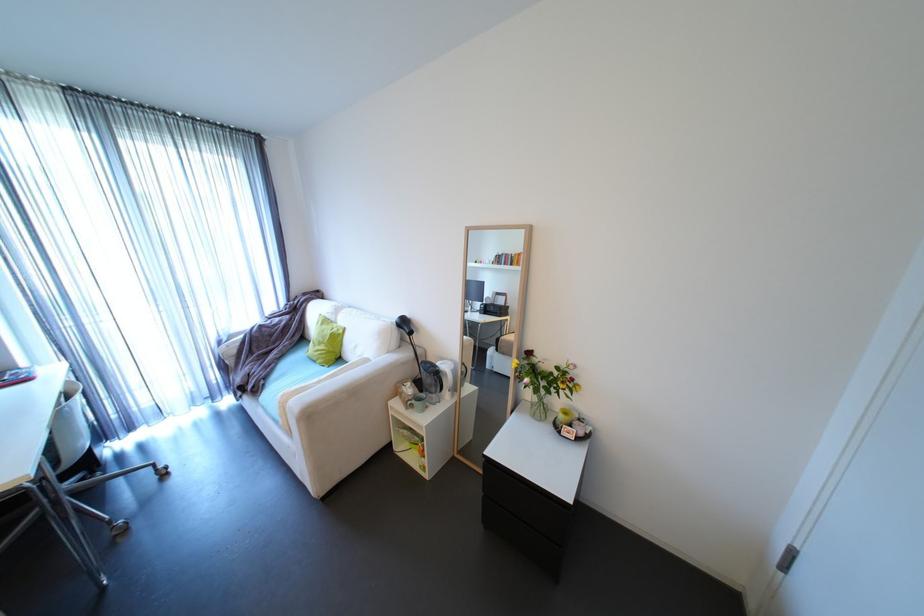
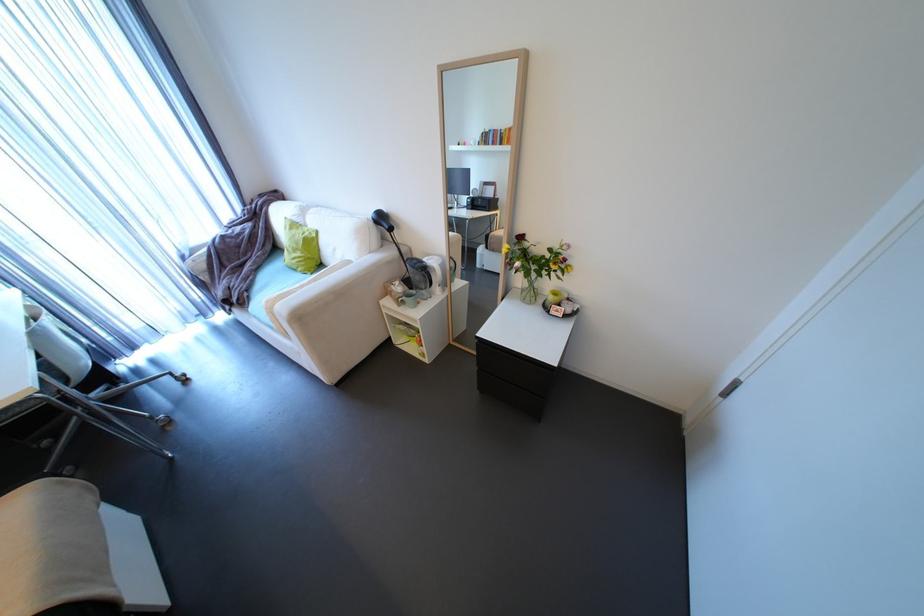
Where in the second image is the point corresponding to point 333,346 from the first image?

(310, 253)